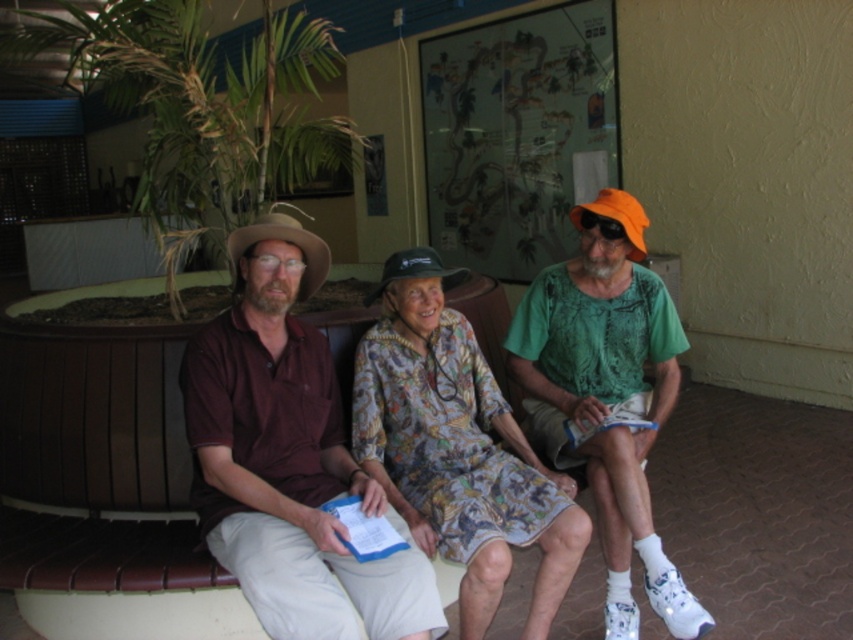
Question: Which of these objects is positioned closest to the dark brown felt cowboy hat at center?

Choices:
 (A) brown cotton shirt at center
 (B) floral fabric dress at center

Answer: (B)

Question: Is printed fabric dress at center to the left of brown cotton shirt at center from the viewer's perspective?

Choices:
 (A) no
 (B) yes

Answer: (A)

Question: Can you confirm if brown felt cowboy hat at left is positioned above dark brown felt cowboy hat at center?

Choices:
 (A) yes
 (B) no

Answer: (A)

Question: Is printed fabric dress at center wider than floral fabric dress at center?

Choices:
 (A) no
 (B) yes

Answer: (B)

Question: Based on their relative distances, which object is nearer to the green fabric shirt at center?

Choices:
 (A) printed fabric dress at center
 (B) brown felt cowboy hat at left
 (C) dark brown felt cowboy hat at center
 (D) floral fabric dress at center

Answer: (A)

Question: Among these objects, which one is farthest from the camera?

Choices:
 (A) green fabric shirt at center
 (B) printed fabric dress at center

Answer: (A)